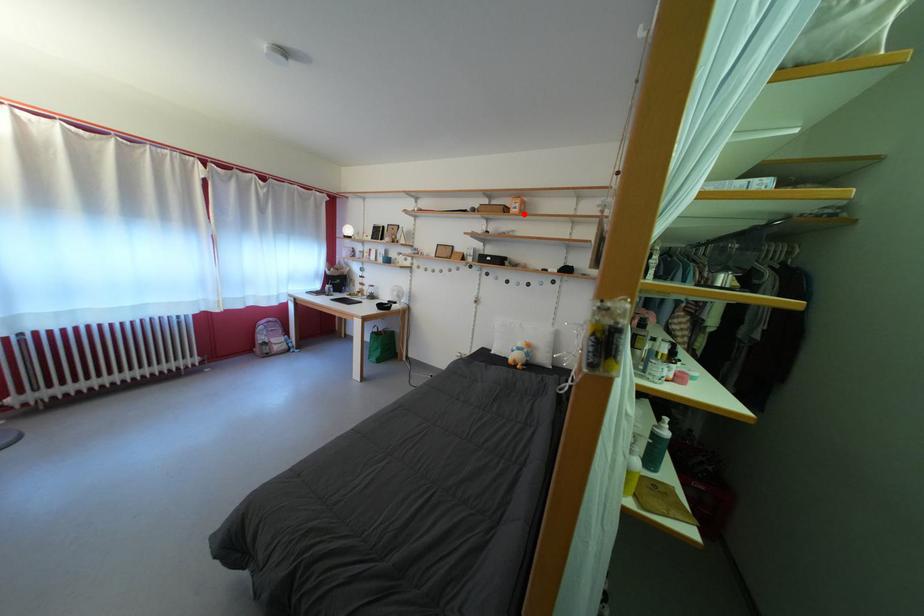
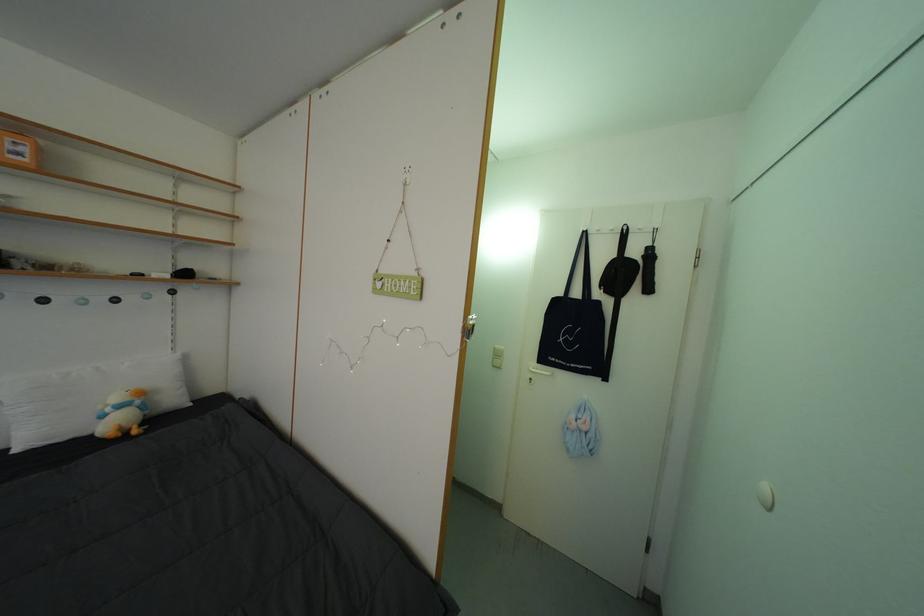
Question: A red point is marked in image1. In image2, is the corresponding 3D point closer to the camera or farther? Reply with the corresponding letter.

Choices:
 (A) The corresponding 3D point is closer.
 (B) The corresponding 3D point is farther.

Answer: (B)